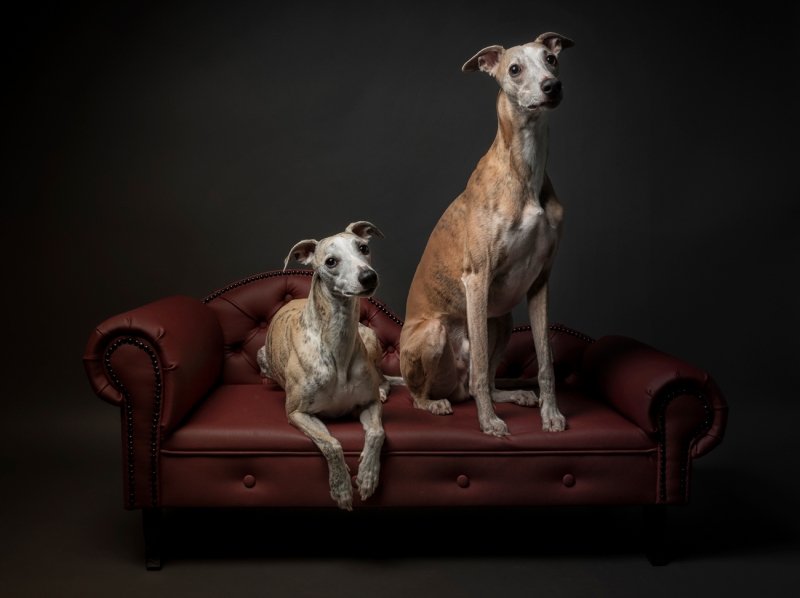
This screenshot has height=598, width=800. I want to click on sofa, so click(x=230, y=408), click(x=502, y=466).